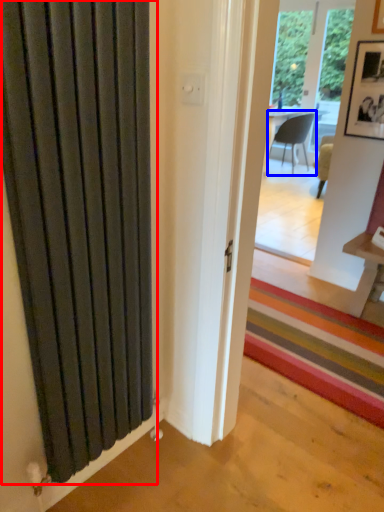
Question: Which point is further to the camera, door (highlighted by a red box) or chair (highlighted by a blue box)?

Choices:
 (A) door
 (B) chair

Answer: (B)